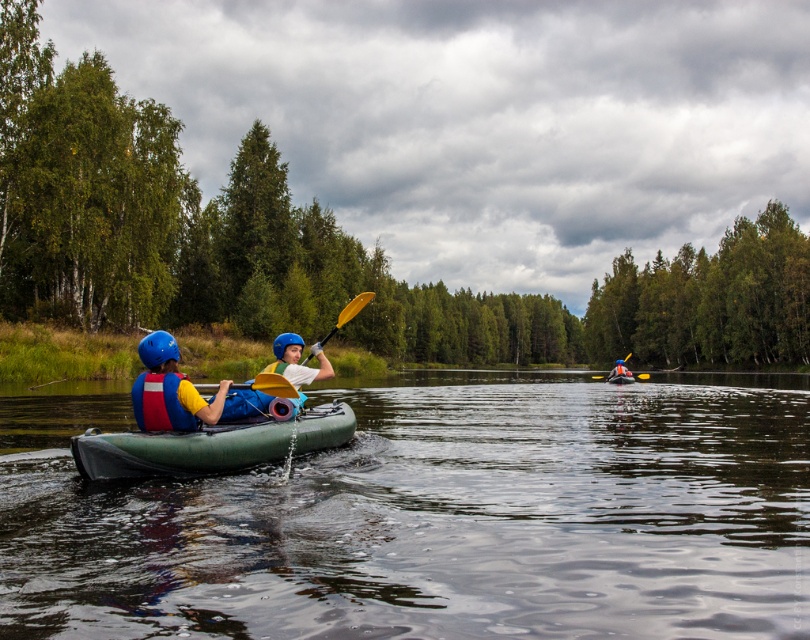
In the scene shown: You are a photographer trying to capture a clear shot of the blue fabric life jacket at left and the yellow plastic paddle at center. Since you want to focus on the smaller object, which one should you zoom in on?

The blue fabric life jacket at left has a lesser width compared to the yellow plastic paddle at center, so you should zoom in on the blue fabric life jacket at left.

You are a photographer trying to capture a clear photo of the blue fabric life jacket at left and the yellow plastic paddle at center. Which object should you focus on first to ensure both are in focus?

A: The blue fabric life jacket at left is closer to the viewer than the yellow plastic paddle at center. To ensure both are in focus, you should focus on the blue fabric life jacket at left first, as it is closer, and the paddle will be in the background.